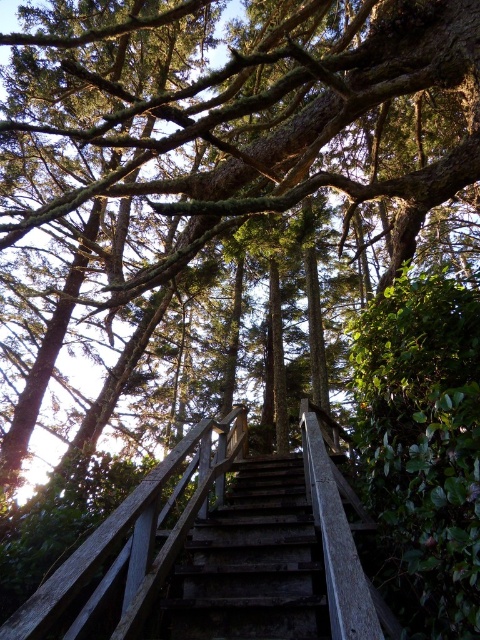
You are a maintenance worker who needs to inspect the wooden rail at center and the dark brown wooden stairs at center. Given that your tool kit is 16 inches wide, will it fit between them without touching either?

The distance between the wooden rail at center and the dark brown wooden stairs at center is 15.70 inches. Since the tool kit is 16 inches wide, it will not fit between them without touching either.

You are a painter standing on the wooden rail at center and dark brown wooden stairs at center in a forest. You want to paint the rail and stairs. Which object is taller so you need a longer ladder?

The wooden rail at center has a greater height compared to dark brown wooden stairs at center, so you need a longer ladder to paint the wooden rail at center.